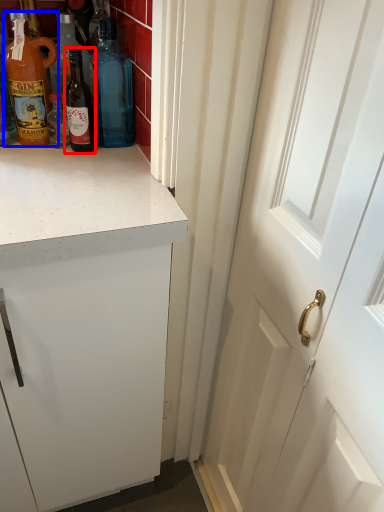
Question: Which point is further to the camera, bottle (highlighted by a red box) or bottle (highlighted by a blue box)?

Choices:
 (A) bottle
 (B) bottle

Answer: (A)